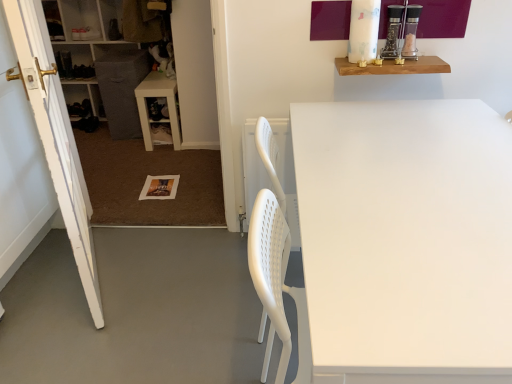
Where is `free point to the right of white painted wood door at left`? Image resolution: width=512 pixels, height=384 pixels. free point to the right of white painted wood door at left is located at coordinates (173, 279).